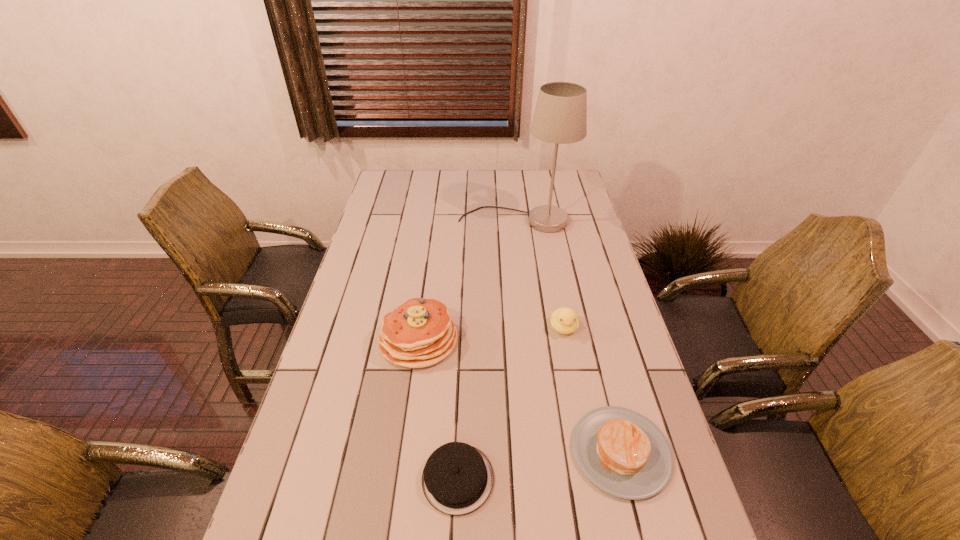
Identify the location of free space located 0.240m at the beak of the duckling. (580, 412).

The height and width of the screenshot is (540, 960). Find the location of `vacant point located 0.350m on the back of the fourth tallest object`. vacant point located 0.350m on the back of the fourth tallest object is located at coordinates (586, 310).

Where is `vacant space located 0.130m on the left of the shortest object`? The width and height of the screenshot is (960, 540). vacant space located 0.130m on the left of the shortest object is located at coordinates (364, 479).

Where is `object at the left edge`? object at the left edge is located at coordinates (419, 333).

This screenshot has height=540, width=960. In order to click on table lamp that is at the right edge in this screenshot , I will do `click(560, 117)`.

The image size is (960, 540). I want to click on duckling present at the right edge, so click(564, 320).

The width and height of the screenshot is (960, 540). In order to click on pancake that is positioned at the right edge in this screenshot , I will do `click(623, 453)`.

Image resolution: width=960 pixels, height=540 pixels. In the image, there is a desktop. In order to click on vacant space at the left edge in this screenshot , I will do `click(369, 225)`.

This screenshot has width=960, height=540. I want to click on free region at the right edge of the desktop, so click(x=575, y=219).

Identify the location of free point between the duckling and the second shortest object. The image size is (960, 540). (592, 389).